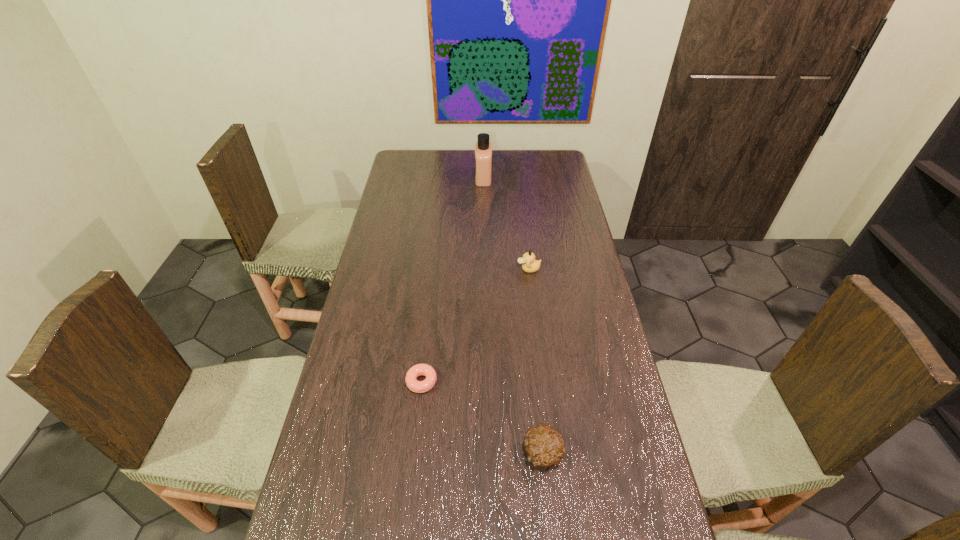
The image size is (960, 540). What are the coordinates of `vacant space positioned on the face of the duckling` in the screenshot? It's located at (468, 269).

Identify the location of vacant region located on the face of the duckling. (497, 269).

Find the location of a particular element. This screenshot has height=540, width=960. free space located on the face of the duckling is located at coordinates (503, 269).

This screenshot has width=960, height=540. Find the location of `vacant space situated 0.160m on the left of the muffin`. vacant space situated 0.160m on the left of the muffin is located at coordinates (459, 453).

Image resolution: width=960 pixels, height=540 pixels. Identify the location of free space located on the right of the second nearest object. (490, 382).

Find the location of a particular element. object that is at the far edge is located at coordinates (483, 149).

The width and height of the screenshot is (960, 540). What are the coordinates of `vacant space at the left edge` in the screenshot? It's located at (386, 372).

This screenshot has height=540, width=960. Identify the location of free space at the right edge of the desktop. (564, 190).

The height and width of the screenshot is (540, 960). In the image, there is a desktop. In order to click on vacant space at the far left corner in this screenshot , I will do `click(418, 167)`.

Locate an element on the screen. vacant area that lies between the second shortest object and the tallest object is located at coordinates (513, 315).